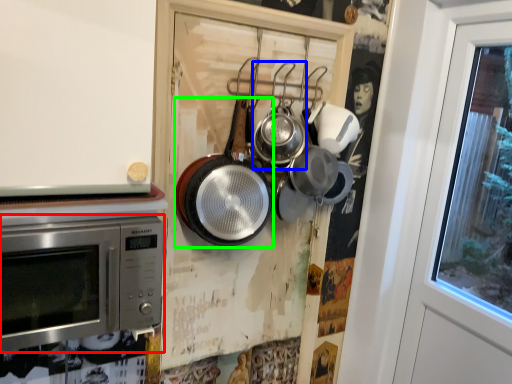
Question: Based on their relative distances, which object is farther from microwave oven (highlighted by a red box)? Choose from frying pan (highlighted by a blue box) and frying pan (highlighted by a green box).

Choices:
 (A) frying pan
 (B) frying pan

Answer: (A)